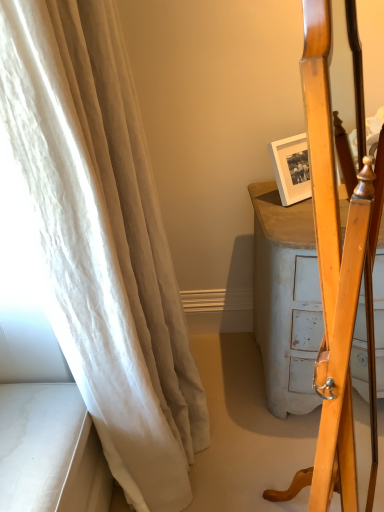
Question: From the image's perspective, would you say wooden mirror at right is positioned over white sheer curtain at left?

Choices:
 (A) yes
 (B) no

Answer: (B)

Question: Does wooden mirror at right have a lesser height compared to white sheer curtain at left?

Choices:
 (A) yes
 (B) no

Answer: (A)

Question: Is wooden mirror at right taller than white sheer curtain at left?

Choices:
 (A) yes
 (B) no

Answer: (B)

Question: Is wooden mirror at right at the right side of white sheer curtain at left?

Choices:
 (A) no
 (B) yes

Answer: (B)

Question: Is wooden mirror at right smaller than white sheer curtain at left?

Choices:
 (A) yes
 (B) no

Answer: (A)

Question: Would you say white sheer curtain at left is part of wooden mirror at right's contents?

Choices:
 (A) yes
 (B) no

Answer: (B)

Question: Considering the relative sizes of white sheer curtain at left and wooden mirror at right in the image provided, is white sheer curtain at left smaller than wooden mirror at right?

Choices:
 (A) yes
 (B) no

Answer: (B)

Question: Could you tell me if white sheer curtain at left is turned towards wooden mirror at right?

Choices:
 (A) yes
 (B) no

Answer: (B)

Question: Considering the relative sizes of white sheer curtain at left and wooden mirror at right in the image provided, is white sheer curtain at left taller than wooden mirror at right?

Choices:
 (A) yes
 (B) no

Answer: (A)

Question: Considering the relative sizes of white sheer curtain at left and wooden mirror at right in the image provided, is white sheer curtain at left thinner than wooden mirror at right?

Choices:
 (A) no
 (B) yes

Answer: (A)

Question: Is white sheer curtain at left next to wooden mirror at right?

Choices:
 (A) yes
 (B) no

Answer: (B)

Question: Is the depth of white sheer curtain at left greater than that of wooden mirror at right?

Choices:
 (A) no
 (B) yes

Answer: (B)

Question: Is point (162, 415) closer or farther from the camera than point (339, 276)?

Choices:
 (A) farther
 (B) closer

Answer: (A)